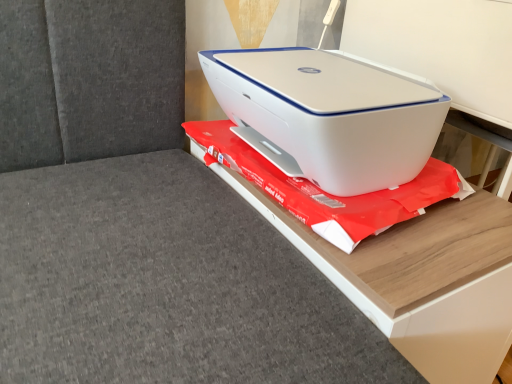
Locate an element on the screen. white plastic printer at center is located at coordinates (327, 193).

Image resolution: width=512 pixels, height=384 pixels. I want to click on white plastic printer at center, so click(327, 193).

Is white plastic printer at upper right not near white plastic printer at upper center?

No.

From the image's perspective, is white plastic printer at upper right on top of white plastic printer at upper center?

Yes, from the image's perspective, white plastic printer at upper right is on top of white plastic printer at upper center.

Is white plastic printer at upper right closer to camera compared to white plastic printer at upper center?

No, it is not.

From a real-world perspective, who is located lower, white plastic printer at upper right or white plastic printer at center?

white plastic printer at center, from a real-world perspective.

From the picture: Could you tell me if white plastic printer at upper right is facing white plastic printer at center?

No, white plastic printer at upper right is not facing towards white plastic printer at center.

From the image's perspective, relative to white plastic printer at center, is white plastic printer at upper right above or below?

white plastic printer at upper right is situated higher than white plastic printer at center in the image.

In the scene shown: Between white plastic printer at upper right and white plastic printer at center, which one is positioned behind?

Positioned behind is white plastic printer at center.

Based on the photo, which object is further away from the camera, white plastic printer at center or white plastic printer at upper center?

white plastic printer at center is further from the camera.

From the image's perspective, which object appears higher, white plastic printer at center or white plastic printer at upper center?

white plastic printer at center appears higher in the image.

Is white plastic printer at center far from white plastic printer at upper center?

white plastic printer at center is near white plastic printer at upper center, not far away.

Is white plastic printer at center turned away from white plastic printer at upper center?

No, white plastic printer at upper center is not at the back of white plastic printer at center.

In terms of width, does white plastic printer at center look wider or thinner when compared to white plastic printer at upper right?

Considering their sizes, white plastic printer at center looks broader than white plastic printer at upper right.

Is white plastic printer at upper right at the back of white plastic printer at center?

No.

Is white plastic printer at center surrounding white plastic printer at upper right?

No, white plastic printer at upper right is not inside white plastic printer at center.

Does white plastic printer at center appear on the left side of white plastic printer at upper right?

No.

Is point (479, 192) closer to viewer compared to point (269, 152)?

No, (479, 192) is further to viewer.

From a real-world perspective, which is physically below, white plastic printer at upper center or white plastic printer at upper right?

white plastic printer at upper center is physically lower.

Is the surface of white plastic printer at upper center in direct contact with white plastic printer at upper right?

No, white plastic printer at upper center is not next to white plastic printer at upper right.

From the image's perspective, between white plastic printer at upper center and white plastic printer at upper right, who is located below?

white plastic printer at upper center.

Are white plastic printer at upper center and white plastic printer at center making contact?

Yes, white plastic printer at upper center is next to white plastic printer at center.

Considering the relative sizes of white plastic printer at upper center and white plastic printer at center in the image provided, is white plastic printer at upper center taller than white plastic printer at center?

Indeed, white plastic printer at upper center has a greater height compared to white plastic printer at center.

Is point (492, 303) farther from camera compared to point (196, 126)?

No, (492, 303) is closer to viewer.

From the image's perspective, is white plastic printer at upper center beneath white plastic printer at center?

Yes, from the image's perspective, white plastic printer at upper center is below white plastic printer at center.

You are a GUI agent. You are given a task and a screenshot of the screen. Output one action in this format:
    pyautogui.click(x=<x>, y=<y>)
    Task: Click on the printer above the white plastic printer at upper center (from the image's perspective)
    The height and width of the screenshot is (384, 512).
    Given the screenshot: What is the action you would take?
    pyautogui.click(x=328, y=115)

Locate an element on the screen. printer in front of the white plastic printer at center is located at coordinates (328, 115).

Considering their positions, is white plastic printer at upper center positioned closer to white plastic printer at upper right than white plastic printer at center?

Among the two, white plastic printer at center is located nearer to white plastic printer at upper right.

From the image, which object appears to be nearer to white plastic printer at upper center, white plastic printer at upper right or white plastic printer at center?

The object closer to white plastic printer at upper center is white plastic printer at center.

Looking at the image, which one is located closer to white plastic printer at center, white plastic printer at upper center or white plastic printer at upper right?

white plastic printer at upper center.

From the image, which object appears to be farther from white plastic printer at upper right, white plastic printer at center or white plastic printer at upper center?

Among the two, white plastic printer at upper center is located further to white plastic printer at upper right.

Considering their positions, is white plastic printer at center positioned further to white plastic printer at upper center than white plastic printer at upper right?

The object further to white plastic printer at upper center is white plastic printer at upper right.

Which object lies nearer to the anchor point white plastic printer at center, white plastic printer at upper right or white plastic printer at upper center?

white plastic printer at upper center.

Find the location of a particular element. material between white plastic printer at upper right and white plastic printer at upper center from top to bottom is located at coordinates (327, 193).